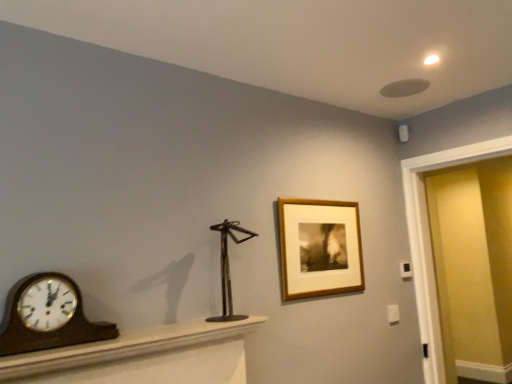
Measure the distance between point (496, 379) and camera.

3.64 meters.

Describe the element at coordinates (143, 357) in the screenshot. This screenshot has height=384, width=512. I see `brown wood mantel at lower left` at that location.

You are a GUI agent. You are given a task and a screenshot of the screen. Output one action in this format:
    pyautogui.click(x=<x>, y=<y>)
    Task: Click on the wooden frame at upper right
    This screenshot has width=512, height=384.
    Given the screenshot: What is the action you would take?
    pyautogui.click(x=319, y=248)

In order to click on matte yellow door at right in this screenshot , I will do `click(473, 266)`.

Based on the photo, from the image's perspective, which is below, matte yellow door at right or wooden polished clock at left?

matte yellow door at right, from the image's perspective.

In terms of width, does matte yellow door at right look wider or thinner when compared to wooden polished clock at left?

Considering their sizes, matte yellow door at right looks broader than wooden polished clock at left.

From a real-world perspective, is matte yellow door at right beneath wooden polished clock at left?

Yes.

Is matte yellow door at right placed right next to wooden polished clock at left?

No, matte yellow door at right is not with wooden polished clock at left.

Is wooden frame at upper right inside matte yellow door at right?

No, wooden frame at upper right is not a part of matte yellow door at right.

Does matte yellow door at right appear on the left side of wooden frame at upper right?

No, matte yellow door at right is not to the left of wooden frame at upper right.

Looking at this image, between matte yellow door at right and wooden frame at upper right, which one has smaller width?

wooden frame at upper right.

Between matte yellow door at right and wooden frame at upper right, which one has smaller size?

With smaller size is wooden frame at upper right.

Measure the distance from wooden frame at upper right to metallic sculpture at center.

They are 16.72 inches apart.

Is point (283, 226) farther from viewer compared to point (221, 239)?

Yes.

Is wooden frame at upper right facing towards metallic sculpture at center?

No.

Which of these two, wooden frame at upper right or metallic sculpture at center, is smaller?

metallic sculpture at center.

Is wooden frame at upper right in front of or behind matte yellow door at right in the image?

wooden frame at upper right is positioned closer to the viewer than matte yellow door at right.

From a real-world perspective, between wooden frame at upper right and matte yellow door at right, who is vertically lower?

matte yellow door at right.

Considering the relative sizes of wooden frame at upper right and matte yellow door at right in the image provided, is wooden frame at upper right bigger than matte yellow door at right?

No.

Is wooden frame at upper right facing away from matte yellow door at right?

That's not correct — wooden frame at upper right is not looking away from matte yellow door at right.

From the image's perspective, is matte yellow door at right beneath metallic sculpture at center?

Correct, matte yellow door at right appears lower than metallic sculpture at center in the image.

Can you tell me how much matte yellow door at right and metallic sculpture at center differ in facing direction?

89.6 degrees.

Can we say matte yellow door at right lies outside metallic sculpture at center?

Indeed, matte yellow door at right is completely outside metallic sculpture at center.

Considering the sizes of objects matte yellow door at right and metallic sculpture at center in the image provided, who is shorter, matte yellow door at right or metallic sculpture at center?

metallic sculpture at center is shorter.

From the picture: Relative to matte yellow door at right, is brown wood mantel at lower left in front or behind?

In the image, brown wood mantel at lower left appears in front of matte yellow door at right.

From the image's perspective, is brown wood mantel at lower left located above or below matte yellow door at right?

brown wood mantel at lower left is situated lower than matte yellow door at right in the image.

Can you confirm if brown wood mantel at lower left is thinner than matte yellow door at right?

Incorrect, the width of brown wood mantel at lower left is not less than that of matte yellow door at right.

Is wooden frame at upper right beside brown wood mantel at lower left?

wooden frame at upper right and brown wood mantel at lower left are not in contact.

The width and height of the screenshot is (512, 384). I want to click on furniture below the wooden frame at upper right (from a real-world perspective), so click(x=143, y=357).

Is wooden frame at upper right positioned with its back to brown wood mantel at lower left?

No, wooden frame at upper right is not facing away from brown wood mantel at lower left.

From a real-world perspective, is wooden frame at upper right above or below brown wood mantel at lower left?

Clearly, from a real-world perspective, wooden frame at upper right is above brown wood mantel at lower left.

In order to click on wall clock in front of the matte yellow door at right in this screenshot , I will do `click(47, 316)`.

The image size is (512, 384). I want to click on picture frame on the left of the matte yellow door at right, so click(319, 248).

Considering their positions, is matte yellow door at right positioned further to wooden frame at upper right than wooden polished clock at left?

matte yellow door at right is further to wooden frame at upper right.

Based on their spatial positions, is brown wood mantel at lower left or matte yellow door at right further from metallic sculpture at center?

matte yellow door at right is positioned further to the anchor metallic sculpture at center.

Consider the image. From the image, which object appears to be nearer to metallic sculpture at center, wooden polished clock at left or brown wood mantel at lower left?

brown wood mantel at lower left is closer to metallic sculpture at center.

From the image, which object appears to be farther from wooden polished clock at left, matte yellow door at right or metallic sculpture at center?

Among the two, matte yellow door at right is located further to wooden polished clock at left.

When comparing their distances from wooden frame at upper right, does wooden polished clock at left or brown wood mantel at lower left seem further?

wooden polished clock at left.

Based on their spatial positions, is matte yellow door at right or wooden polished clock at left further from metallic sculpture at center?

matte yellow door at right lies further to metallic sculpture at center than the other object.

Looking at the image, which one is located further to metallic sculpture at center, wooden frame at upper right or brown wood mantel at lower left?

Based on the image, wooden frame at upper right appears to be further to metallic sculpture at center.

Looking at the image, which one is located closer to wooden polished clock at left, brown wood mantel at lower left or metallic sculpture at center?

Based on the image, brown wood mantel at lower left appears to be nearer to wooden polished clock at left.

Where is `furniture between wooden polished clock at left and wooden frame at upper right`? This screenshot has height=384, width=512. furniture between wooden polished clock at left and wooden frame at upper right is located at coordinates (143, 357).

Where is `sculpture between brown wood mantel at lower left and wooden frame at upper right from front to back`? This screenshot has width=512, height=384. sculpture between brown wood mantel at lower left and wooden frame at upper right from front to back is located at coordinates (228, 269).

Where is `wall clock positioned between brown wood mantel at lower left and metallic sculpture at center from near to far`? This screenshot has width=512, height=384. wall clock positioned between brown wood mantel at lower left and metallic sculpture at center from near to far is located at coordinates (47, 316).

At what (x,y) coordinates should I click in order to perform the action: click on sculpture between wooden polished clock at left and matte yellow door at right in the horizontal direction. Please return your answer as a coordinate pair (x, y). The width and height of the screenshot is (512, 384). Looking at the image, I should click on (228, 269).